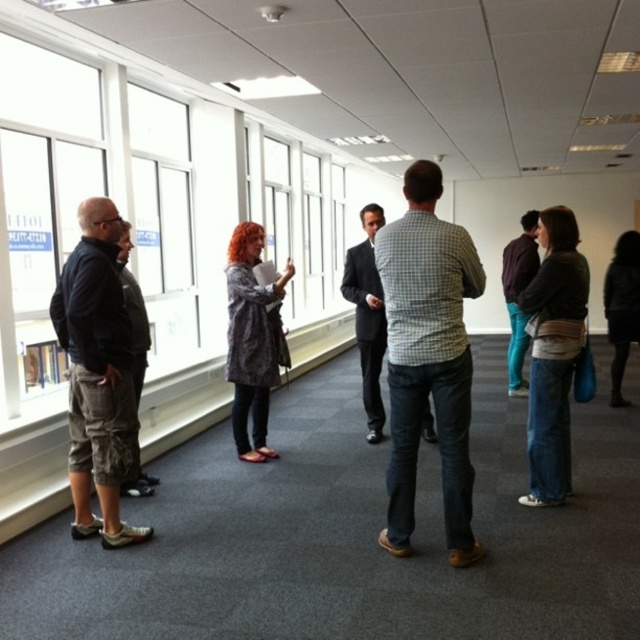
Can you confirm if denim jeans at lower right is positioned below patterned fabric coat at center?

Yes, denim jeans at lower right is below patterned fabric coat at center.

Is point (563, 436) farther from viewer compared to point (241, 227)?

No, it is in front of (241, 227).

At what (x,y) coordinates should I click in order to perform the action: click on denim jeans at lower right. Please return your answer as a coordinate pair (x, y). This screenshot has height=640, width=640. Looking at the image, I should click on (554, 353).